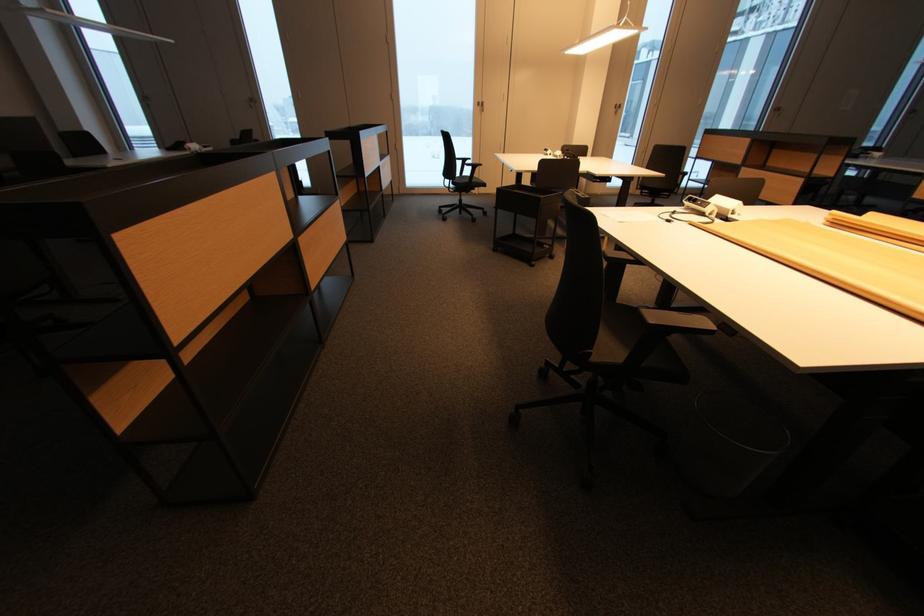
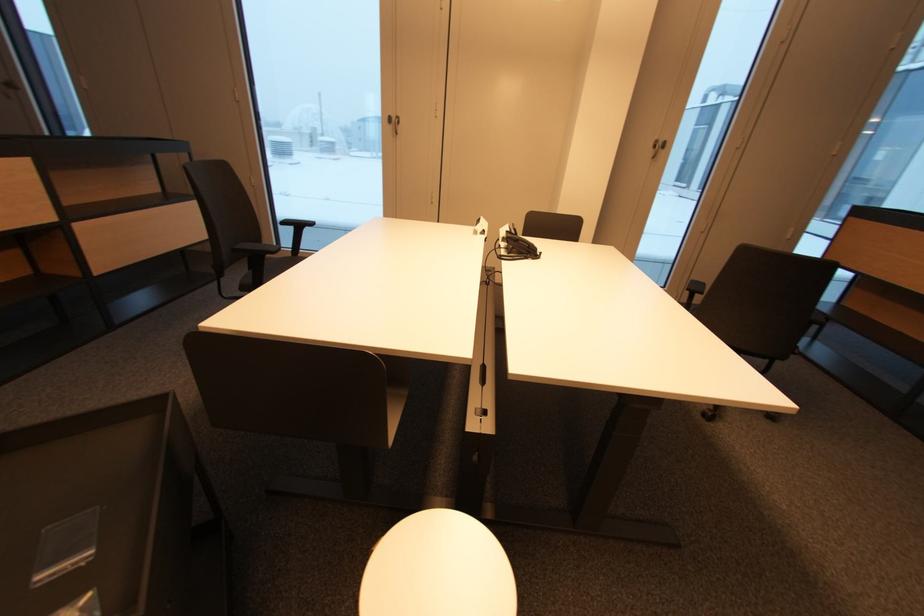
In a continuous first-person perspective shot, in which direction is the camera moving?

The cameraman moved toward right, forward.